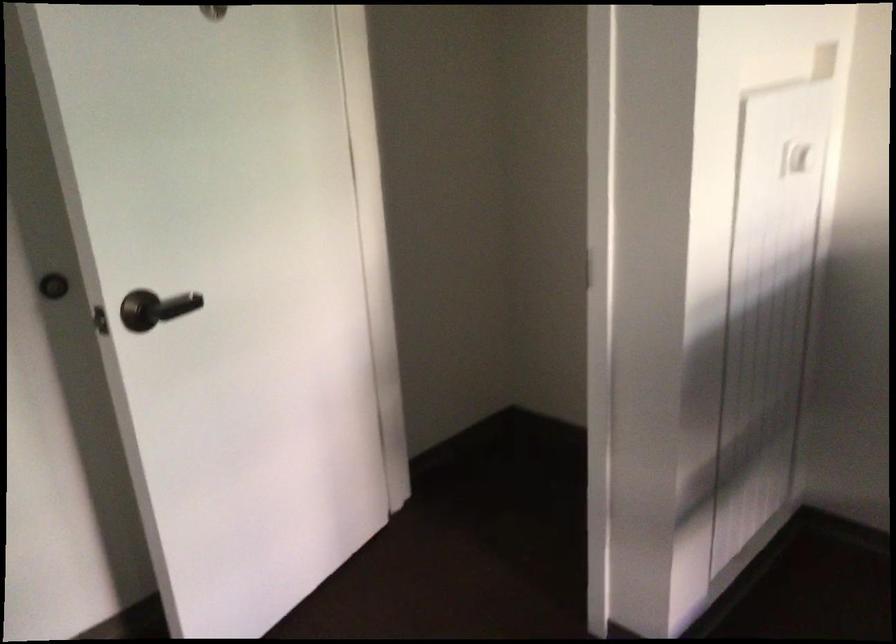
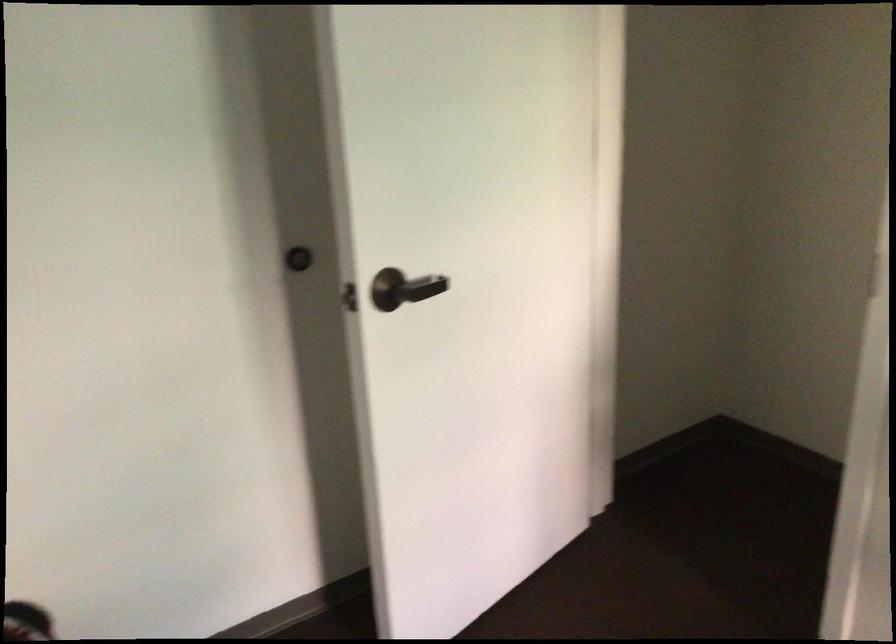
Question: The first image is from the beginning of the video and the second image is from the end. How did the camera likely rotate when shooting the video?

Choices:
 (A) Left
 (B) Right
 (C) Up
 (D) Down

Answer: (A)